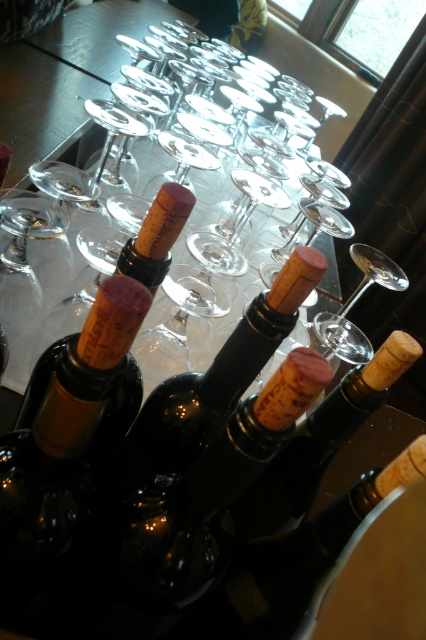
Can you confirm if brown corked bottle at center is taller than clear glass wine glass at center?

No.

The image size is (426, 640). What are the coordinates of `brown corked bottle at center` in the screenshot? It's located at (319, 442).